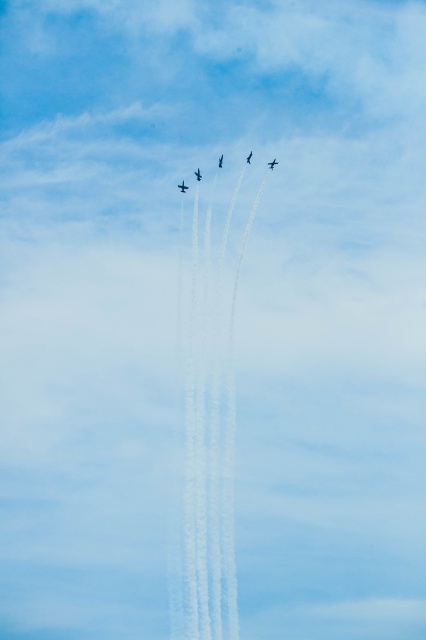
Between point (190, 580) and point (270, 163), which one is positioned behind?

Point (190, 580)

Can you confirm if white vapor trails at center is positioned above shiny black airplane at center?

Actually, white vapor trails at center is below shiny black airplane at center.

The width and height of the screenshot is (426, 640). I want to click on white vapor trails at center, so click(x=207, y=429).

Is shiny silver jet at center taller than shiny silver jet at upper center?

Incorrect, shiny silver jet at center's height is not larger of shiny silver jet at upper center's.

Does shiny silver jet at center have a lesser width compared to shiny silver jet at upper center?

No, shiny silver jet at center is not thinner than shiny silver jet at upper center.

Does point (198, 180) come in front of point (221, 161)?

Yes, it is in front of point (221, 161).

The width and height of the screenshot is (426, 640). I want to click on shiny silver jet at center, so [x=198, y=173].

Is shiny silver jet at upper center to the left of shiny blue jet at center from the viewer's perspective?

Correct, you'll find shiny silver jet at upper center to the left of shiny blue jet at center.

Between shiny silver jet at upper center and shiny blue jet at center, which one appears on the right side from the viewer's perspective?

Positioned to the right is shiny blue jet at center.

Does point (221, 156) come farther from viewer compared to point (252, 154)?

No, it is not.

Locate an element on the screen. This screenshot has width=426, height=640. shiny silver jet at upper center is located at coordinates (219, 161).